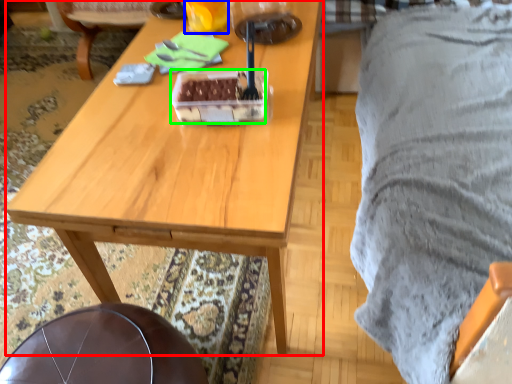
Question: Which object is positioned farthest from desk (highlighted by a red box)? Select from coffee cup (highlighted by a blue box) and food (highlighted by a green box).

Choices:
 (A) coffee cup
 (B) food

Answer: (A)